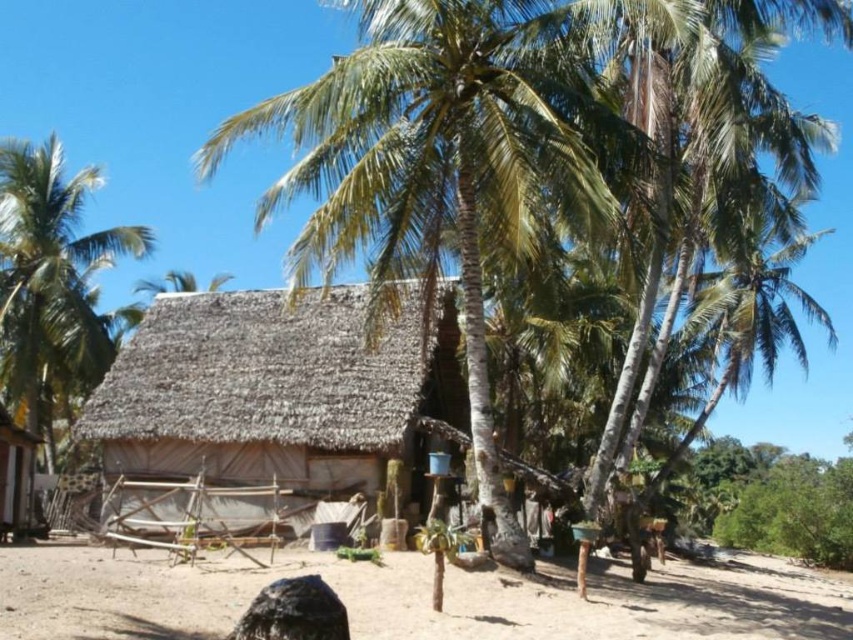
Is green leafy coconut tree at center wider than brown sandy ground at lower center?

No, green leafy coconut tree at center is not wider than brown sandy ground at lower center.

At what (x,y) coordinates should I click in order to perform the action: click on green leafy coconut tree at center. Please return your answer as a coordinate pair (x, y). Looking at the image, I should click on (509, 148).

Identify the location of green leafy coconut tree at center. (509, 148).

Is brown sandy ground at lower center positioned at the back of green leafy palm tree at upper left?

No, it is not.

Is brown sandy ground at lower center smaller than green leafy palm tree at upper left?

Yes.

Does point (621, 589) come behind point (22, 358)?

No, it is not.

The width and height of the screenshot is (853, 640). Identify the location of brown sandy ground at lower center. [410, 600].

Which is in front, point (54, 372) or point (20, 492)?

Positioned in front is point (20, 492).

Does green leafy palm tree at upper left have a larger size compared to matte brown hut at lower left?

Yes, green leafy palm tree at upper left is bigger than matte brown hut at lower left.

Locate an element on the screen. This screenshot has height=640, width=853. green leafy palm tree at upper left is located at coordinates (51, 284).